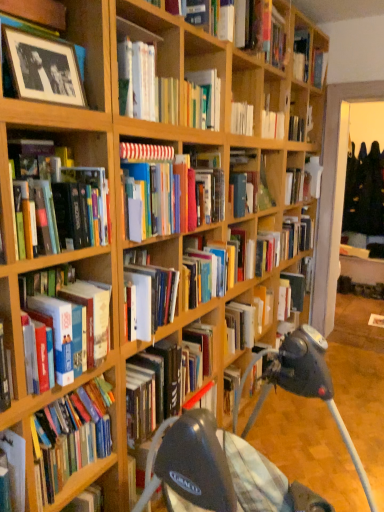
Question: Which direction should I rotate to look at multicolored hardcover books at center, marked as the 7th book in a bottom-to-top arrangement?

Choices:
 (A) right
 (B) left

Answer: (B)

Question: In which direction should I rotate to look at hardcover book at center, the 6th book when ordered from bottom to top?

Choices:
 (A) left
 (B) right

Answer: (B)

Question: Does black matte photo frame at upper left, arranged as the 4th book when viewed from the top, appear on the right side of hardcover books at center, acting as the 11th book starting from the bottom?

Choices:
 (A) no
 (B) yes

Answer: (A)

Question: Can you confirm if black matte photo frame at upper left, arranged as the 4th book when viewed from the top, is bigger than hardcover books at center, which is the third book from top to bottom?

Choices:
 (A) yes
 (B) no

Answer: (B)

Question: From the image's perspective, is black matte photo frame at upper left, arranged as the 4th book when viewed from the top, under hardcover books at center, which is the third book from top to bottom?

Choices:
 (A) yes
 (B) no

Answer: (A)

Question: Is black matte photo frame at upper left, placed as the tenth book when sorted from bottom to top, directly adjacent to hardcover books at center, acting as the 11th book starting from the bottom?

Choices:
 (A) yes
 (B) no

Answer: (B)

Question: Is black matte photo frame at upper left, arranged as the 4th book when viewed from the top, wider than hardcover books at center, which is the third book from top to bottom?

Choices:
 (A) yes
 (B) no

Answer: (B)

Question: From the image's perspective, does black matte photo frame at upper left, arranged as the 4th book when viewed from the top, appear higher than hardcover books at center, acting as the 11th book starting from the bottom?

Choices:
 (A) no
 (B) yes

Answer: (A)

Question: From a real-world perspective, is hardcover book at left, which is the 1th book in bottom-to-top order, on top of wooden bookshelf at lower left?

Choices:
 (A) yes
 (B) no

Answer: (A)

Question: Is hardcover book at left, which is the 1th book in bottom-to-top order, further to camera compared to wooden bookshelf at lower left?

Choices:
 (A) yes
 (B) no

Answer: (B)

Question: Considering the relative sizes of hardcover book at left, which is the 1th book in bottom-to-top order, and wooden bookshelf at lower left in the image provided, is hardcover book at left, which is the 1th book in bottom-to-top order, taller than wooden bookshelf at lower left?

Choices:
 (A) yes
 (B) no

Answer: (A)

Question: Is hardcover book at left, positioned as the thirteenth book in top-to-bottom order, wider than wooden bookshelf at lower left?

Choices:
 (A) yes
 (B) no

Answer: (B)

Question: Is hardcover book at left, positioned as the thirteenth book in top-to-bottom order, positioned with its back to wooden bookshelf at lower left?

Choices:
 (A) no
 (B) yes

Answer: (A)

Question: From the image's perspective, is hardcover book at left, positioned as the thirteenth book in top-to-bottom order, located above wooden bookshelf at lower left?

Choices:
 (A) no
 (B) yes

Answer: (B)

Question: From a real-world perspective, is hardcover books at left, the 9th book viewed from the top, over wooden bookshelf at lower left?

Choices:
 (A) no
 (B) yes

Answer: (B)